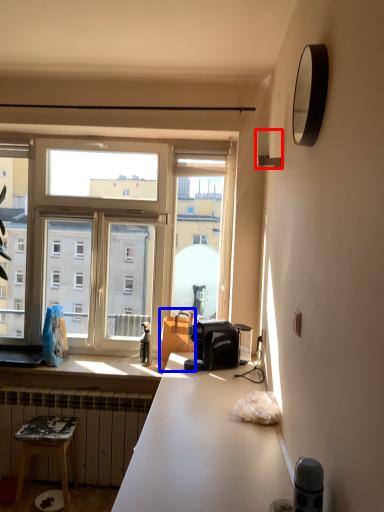
Question: Among these objects, which one is nearest to the camera, lamp (highlighted by a red box) or handbag (highlighted by a blue box)?

Choices:
 (A) lamp
 (B) handbag

Answer: (A)